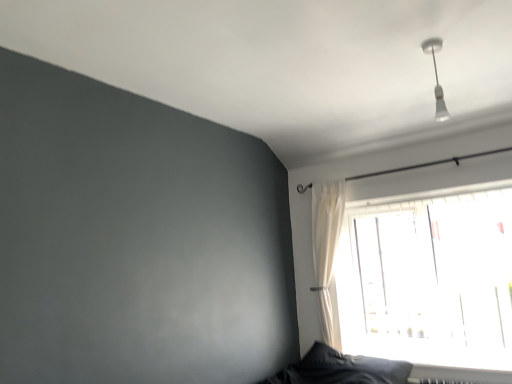
Question: Is point (350, 375) closer or farther from the camera than point (431, 259)?

Choices:
 (A) closer
 (B) farther

Answer: (A)

Question: From the image's perspective, is dark gray fabric pillow at lower right located above or below transparent glass window at upper right?

Choices:
 (A) below
 (B) above

Answer: (A)

Question: Which is nearer to the transparent glass window at upper right?

Choices:
 (A) white glossy light fixture at upper right
 (B) dark gray fabric pillow at lower right
 (C) white sheer curtain at upper right

Answer: (C)

Question: Which of these objects is positioned farthest from the transparent glass window at upper right?

Choices:
 (A) white glossy light fixture at upper right
 (B) dark gray fabric pillow at lower right
 (C) white sheer curtain at upper right

Answer: (A)